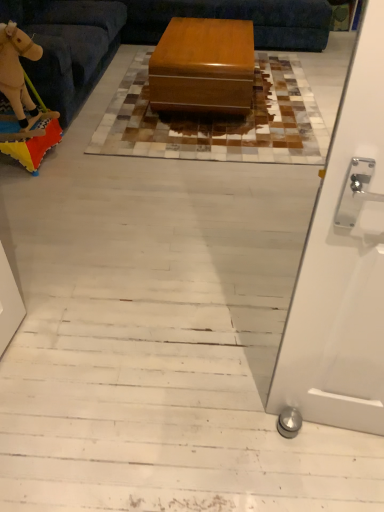
Find the location of a particular element. The image size is (384, 512). free spot in front of glossy wood table at center is located at coordinates (237, 137).